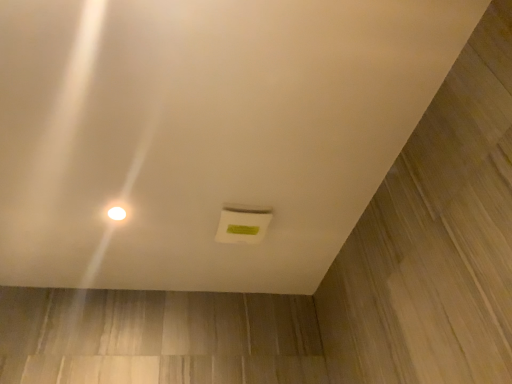
Describe the element at coordinates (116, 213) in the screenshot. I see `white glossy light bulb at upper left` at that location.

Where is `white glossy light bulb at upper left`? white glossy light bulb at upper left is located at coordinates (x=116, y=213).

Identify the location of white glossy light bulb at upper left. (116, 213).